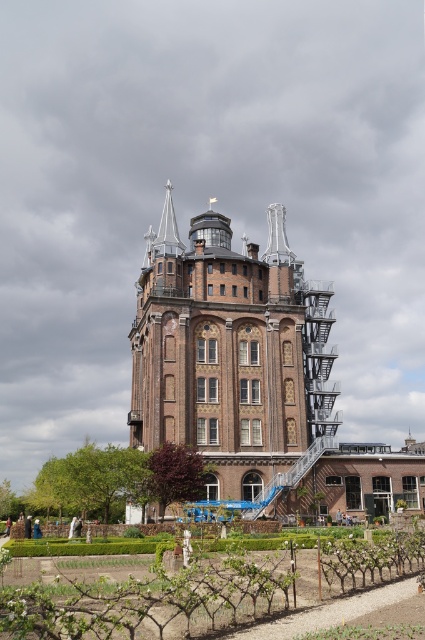
Question: Which of the following is the closest to the observer?

Choices:
 (A) green leafy vines at lower center
 (B) brown brick tower at center

Answer: (A)

Question: Is brown brick tower at center to the right of green leafy vines at lower center from the viewer's perspective?

Choices:
 (A) yes
 (B) no

Answer: (A)

Question: Which point is farther to the camera?

Choices:
 (A) (411, 564)
 (B) (186, 349)

Answer: (B)

Question: Does brown brick tower at center lie behind green leafy vines at lower center?

Choices:
 (A) no
 (B) yes

Answer: (B)

Question: Is brown brick tower at center closer to camera compared to green leafy vines at lower center?

Choices:
 (A) yes
 (B) no

Answer: (B)